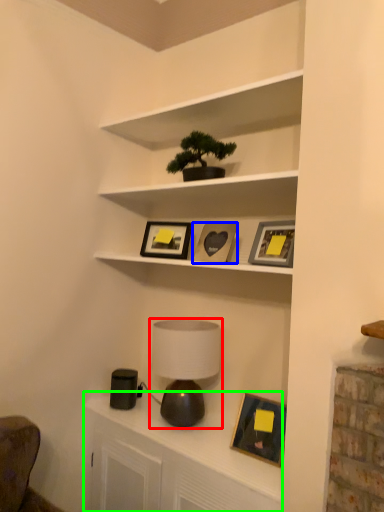
Question: Which object is positioned closest to table lamp (highlighted by a red box)? Select from picture frame (highlighted by a blue box) and dresser (highlighted by a green box).

Choices:
 (A) picture frame
 (B) dresser

Answer: (B)